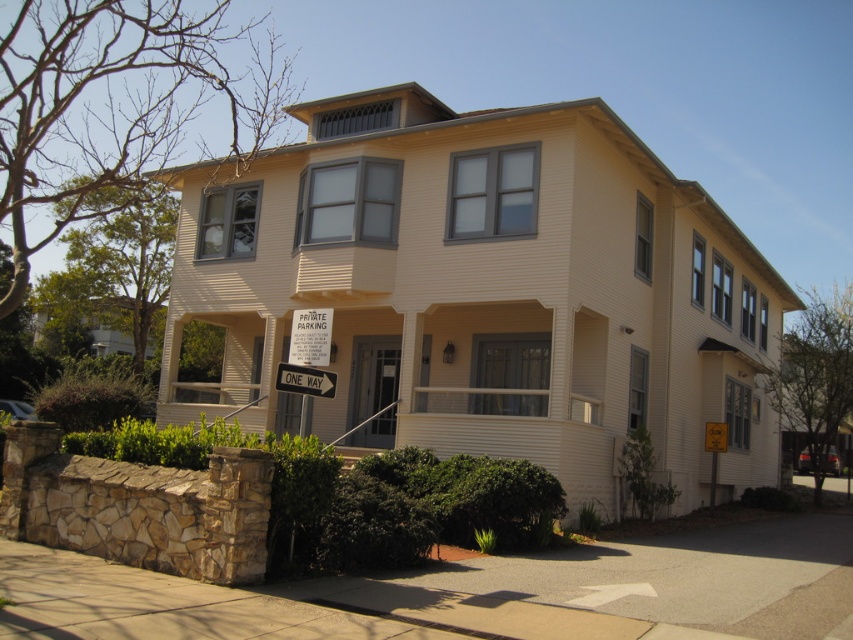
You are a contractor measuring the facade of the two story residential building. You need to locate the white painted wood trim at upper center. According to the coordinates provided, where would you find it?

The white painted wood trim at upper center is located at coordinates point (485, 291).